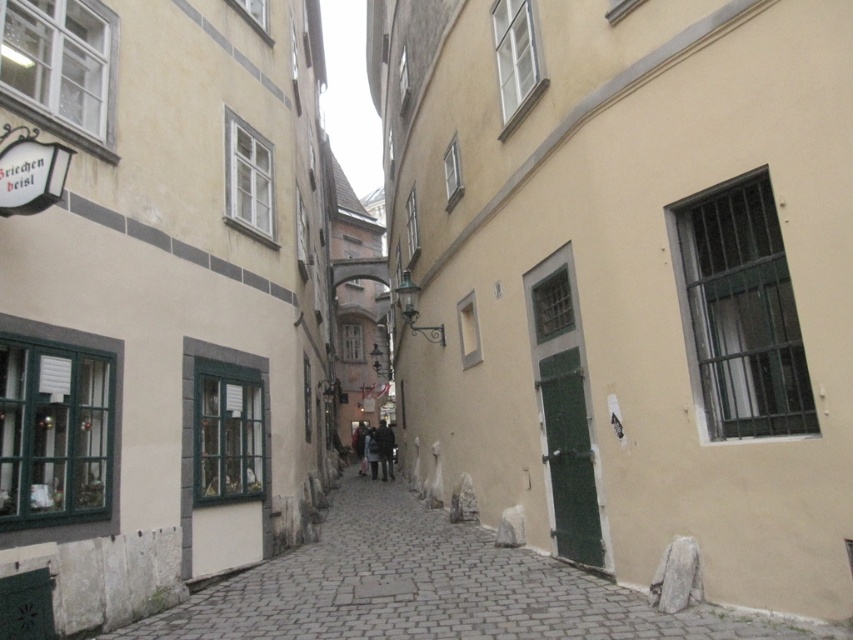
Question: Which of the following is the closest to the observer?

Choices:
 (A) dark gray fabric coat at center
 (B) smooth stone wall at lower left

Answer: (B)

Question: Which object appears closest to the camera in this image?

Choices:
 (A) smooth stone wall at lower left
 (B) dark gray fabric coat at center

Answer: (A)

Question: In this image, where is smooth stone wall at lower left located relative to dark gray fabric coat at center?

Choices:
 (A) right
 (B) left

Answer: (B)

Question: Can you confirm if smooth stone wall at lower left is positioned above dark gray fabric coat at center?

Choices:
 (A) yes
 (B) no

Answer: (A)

Question: Which point appears farthest from the camera in this image?

Choices:
 (A) (531, 582)
 (B) (383, 458)

Answer: (B)

Question: Can you confirm if smooth stone wall at lower left is bigger than dark gray fabric coat at center?

Choices:
 (A) yes
 (B) no

Answer: (B)